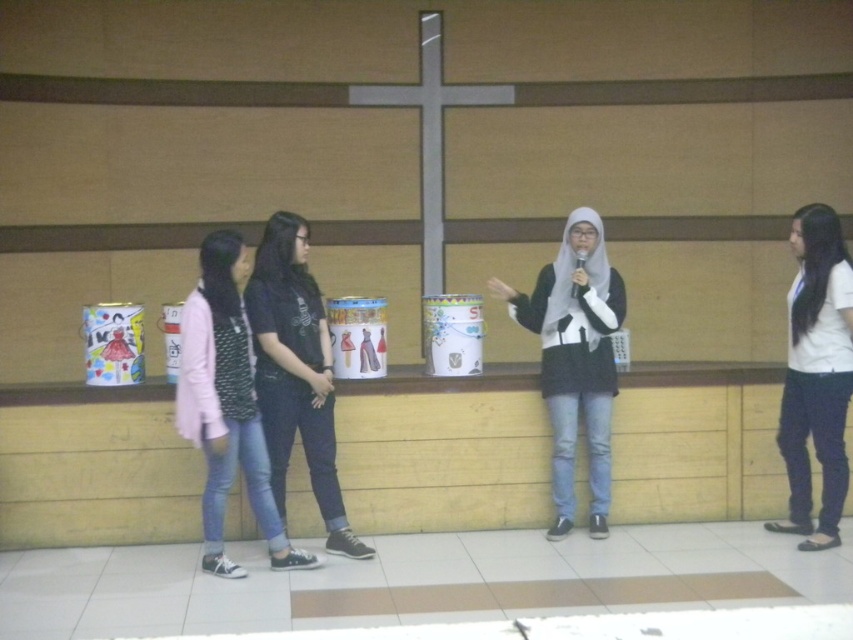
You are a photographer standing at the back of the room. You want to take a photo of the dark blue jeans at center and the white matte shirt at right so that both are in focus. The camera you are using has a depth of field that can cover 10 feet. Will both subjects be in focus?

The dark blue jeans at center and white matte shirt at right are 9.72 feet apart from each other. Since the camera can cover 10 feet, both subjects will be in focus.